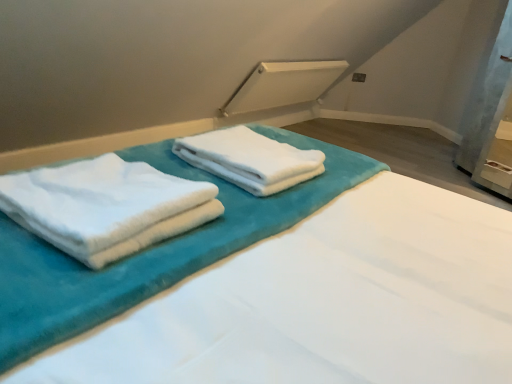
Question: Can you confirm if white soft towels at center is thinner than white soft towel at center, which is the first towel in back-to-front order?

Choices:
 (A) yes
 (B) no

Answer: (B)

Question: Considering the relative sizes of white soft towels at center and white soft towel at center, arranged as the second towel when viewed from the front, in the image provided, is white soft towels at center shorter than white soft towel at center, arranged as the second towel when viewed from the front,?

Choices:
 (A) no
 (B) yes

Answer: (A)

Question: From a real-world perspective, is white soft towels at center below white soft towel at center, arranged as the second towel when viewed from the front?

Choices:
 (A) no
 (B) yes

Answer: (A)

Question: Is white soft towels at center positioned behind white soft towel at center, arranged as the second towel when viewed from the front?

Choices:
 (A) yes
 (B) no

Answer: (B)

Question: From the image's perspective, is white soft towels at center on top of white soft towel at center, arranged as the second towel when viewed from the front?

Choices:
 (A) yes
 (B) no

Answer: (A)

Question: Would you consider white soft towels at center to be distant from white soft towel at center, which is the first towel in back-to-front order?

Choices:
 (A) no
 (B) yes

Answer: (A)

Question: Is white soft towel at center, arranged as the second towel when viewed from the front, far away from white fluffy towels at left, the 1th towel in the front-to-back sequence?

Choices:
 (A) no
 (B) yes

Answer: (A)

Question: Considering the relative sizes of white soft towel at center, which is the first towel in back-to-front order, and white fluffy towels at left, the 1th towel in the front-to-back sequence, in the image provided, is white soft towel at center, which is the first towel in back-to-front order, wider than white fluffy towels at left, the 1th towel in the front-to-back sequence,?

Choices:
 (A) yes
 (B) no

Answer: (B)

Question: Does white soft towel at center, which is the first towel in back-to-front order, have a larger size compared to white fluffy towels at left, the second towel positioned from the back?

Choices:
 (A) yes
 (B) no

Answer: (B)

Question: Is white soft towel at center, which is the first towel in back-to-front order, completely or partially outside of white fluffy towels at left, the second towel positioned from the back?

Choices:
 (A) yes
 (B) no

Answer: (A)

Question: Is white soft towel at center, arranged as the second towel when viewed from the front, to the left of white fluffy towels at left, the 1th towel in the front-to-back sequence, from the viewer's perspective?

Choices:
 (A) no
 (B) yes

Answer: (A)

Question: Is white soft towel at center, which is the first towel in back-to-front order, closer to camera compared to white fluffy towels at left, the second towel positioned from the back?

Choices:
 (A) yes
 (B) no

Answer: (B)

Question: Considering the relative sizes of white fluffy towels at left, the 1th towel in the front-to-back sequence, and white soft towel at center, arranged as the second towel when viewed from the front, in the image provided, is white fluffy towels at left, the 1th towel in the front-to-back sequence, bigger than white soft towel at center, arranged as the second towel when viewed from the front,?

Choices:
 (A) no
 (B) yes

Answer: (B)